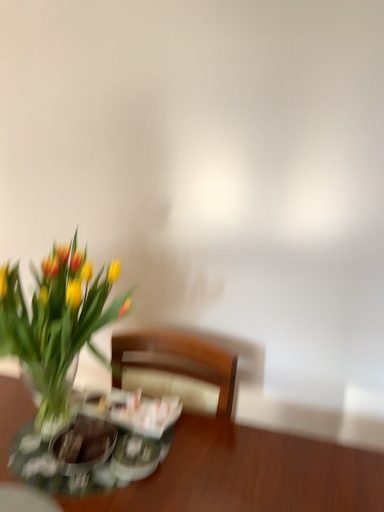
Question: Choose the correct answer: Is wooden table at lower left inside translucent glass vase at left or outside it?

Choices:
 (A) inside
 (B) outside

Answer: (B)

Question: Does point (18, 392) appear closer or farther from the camera than point (46, 433)?

Choices:
 (A) closer
 (B) farther

Answer: (B)

Question: From the image's perspective, relative to translucent glass vase at left, is wooden table at lower left above or below?

Choices:
 (A) below
 (B) above

Answer: (A)

Question: Does point click(61, 375) appear closer or farther from the camera than point click(193, 426)?

Choices:
 (A) farther
 (B) closer

Answer: (B)

Question: Relative to wooden table at lower left, is translucent glass vase at left in front or behind?

Choices:
 (A) front
 (B) behind

Answer: (A)

Question: From a real-world perspective, is translucent glass vase at left positioned above or below wooden table at lower left?

Choices:
 (A) above
 (B) below

Answer: (A)

Question: Looking at their shapes, would you say translucent glass vase at left is wider or thinner than wooden table at lower left?

Choices:
 (A) wide
 (B) thin

Answer: (B)